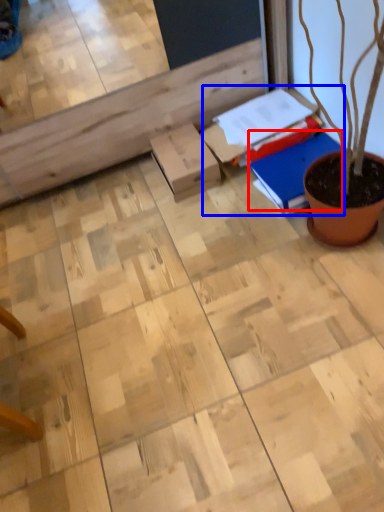
Question: Which object appears closest to the camera in this image, notebook (highlighted by a red box) or book (highlighted by a blue box)?

Choices:
 (A) notebook
 (B) book

Answer: (A)